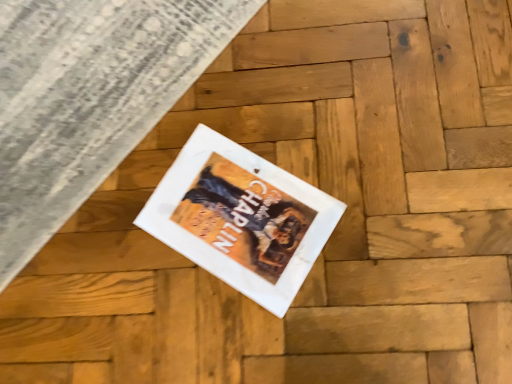
Identify the location of blank space situated above white matte picture frame at center (from a real-world perspective). (234, 209).